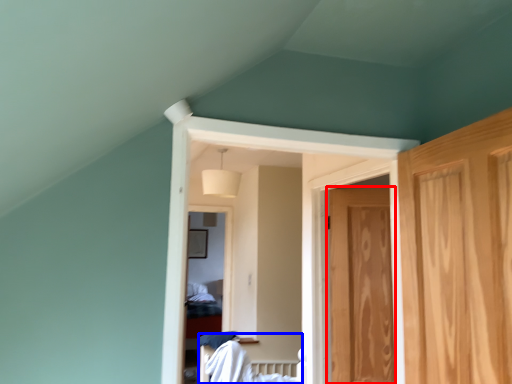
Question: Which object is closer to the camera taking this photo, door (highlighted by a red box) or bed (highlighted by a blue box)?

Choices:
 (A) door
 (B) bed

Answer: (B)